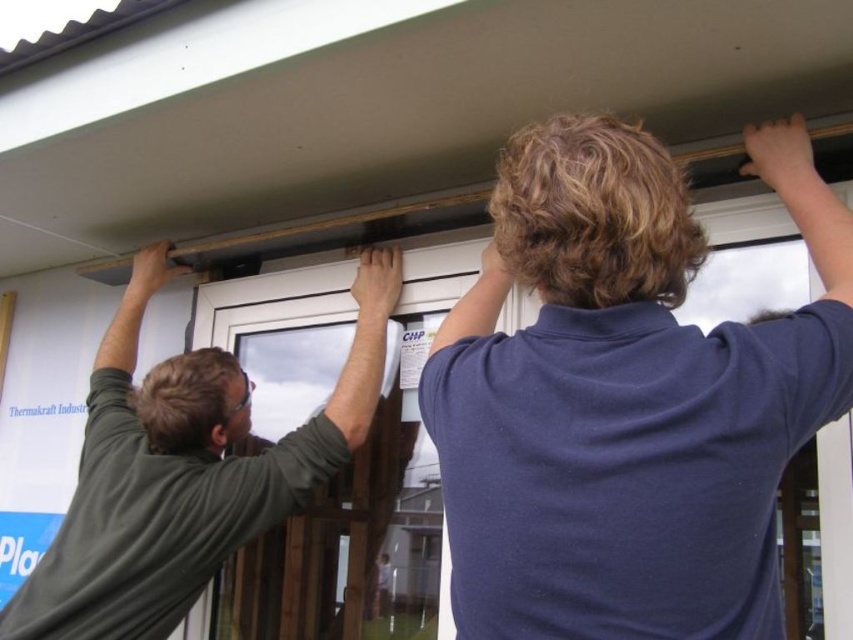
Question: Is dark blue shirt at upper center smaller than dark green shirt at upper left?

Choices:
 (A) yes
 (B) no

Answer: (A)

Question: Which of the following is the farthest from the observer?

Choices:
 (A) (x=746, y=621)
 (B) (x=322, y=412)

Answer: (B)

Question: Observing the image, what is the correct spatial positioning of dark blue shirt at upper center in reference to dark green shirt at upper left?

Choices:
 (A) above
 (B) below

Answer: (A)

Question: Among these objects, which one is farthest from the camera?

Choices:
 (A) dark green shirt at upper left
 (B) dark blue shirt at upper center

Answer: (A)

Question: Is dark blue shirt at upper center bigger than dark green shirt at upper left?

Choices:
 (A) no
 (B) yes

Answer: (A)